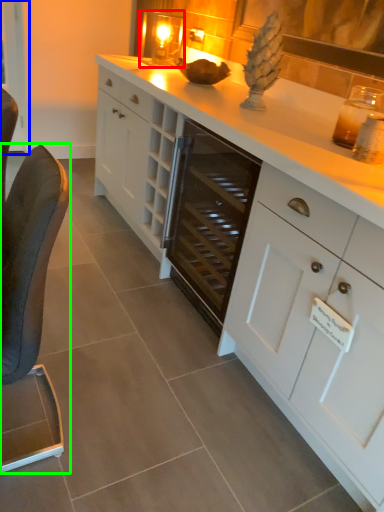
Question: Based on their relative distances, which object is farther from candle holder (highlighted by a red box)? Choose from glass door (highlighted by a blue box) and furniture (highlighted by a green box).

Choices:
 (A) glass door
 (B) furniture

Answer: (B)